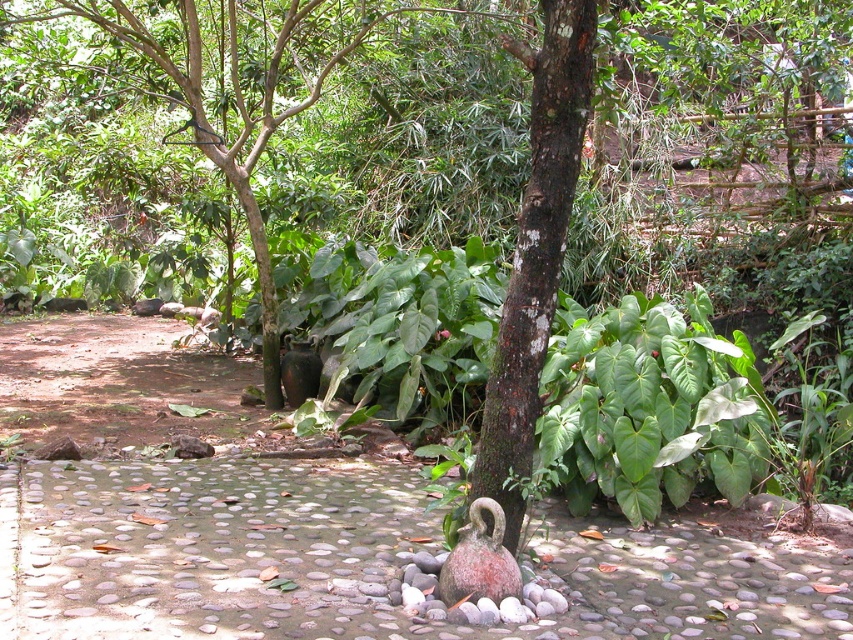
Question: Which of the following is the closest to the observer?

Choices:
 (A) pebble stone path at center
 (B) rusty ceramic swan at center

Answer: (B)

Question: Does brown rough bark tree at center have a smaller size compared to green leafy tree at center?

Choices:
 (A) no
 (B) yes

Answer: (B)

Question: Estimate the real-world distances between objects in this image. Which object is closer to the brown rough bark tree at center?

Choices:
 (A) rusty ceramic swan at center
 (B) pebble stone path at center
 (C) green leafy tree at center

Answer: (A)

Question: Which object appears closest to the camera in this image?

Choices:
 (A) pebble stone path at center
 (B) rusty ceramic swan at center

Answer: (B)

Question: Can you confirm if pebble stone path at center is smaller than brown rough bark tree at center?

Choices:
 (A) yes
 (B) no

Answer: (A)

Question: Does green leafy tree at center have a lesser width compared to rusty ceramic swan at center?

Choices:
 (A) no
 (B) yes

Answer: (A)